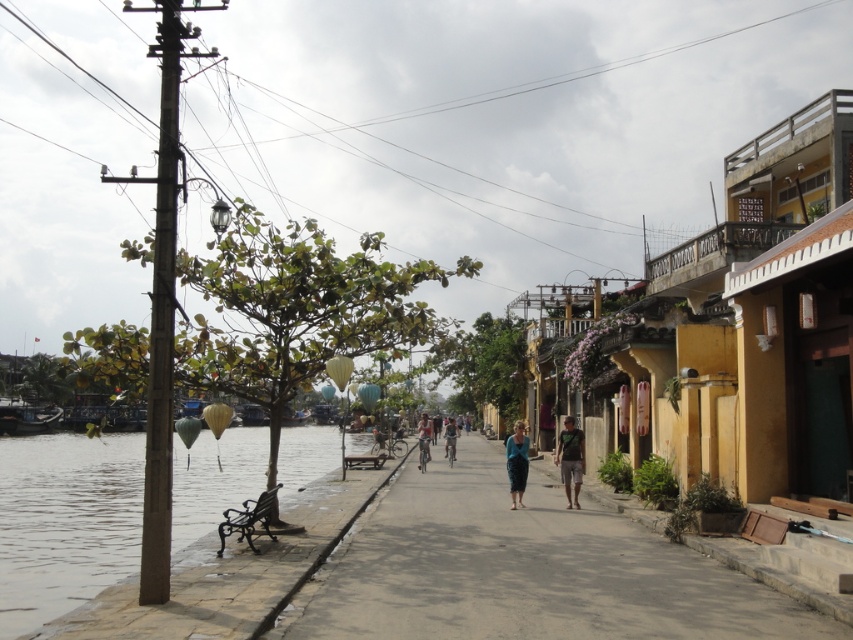
Question: Which object is positioned farthest from the light blue fabric shirt at center?

Choices:
 (A) smooth concrete pavement at center
 (B) blue fabric skirt at center
 (C) green fabric shirt at center

Answer: (A)

Question: Does smooth concrete pavement at center have a lesser width compared to light blue fabric shirt at center?

Choices:
 (A) no
 (B) yes

Answer: (A)

Question: Can you confirm if smooth concrete pavement at center is positioned above light blue fabric at center?

Choices:
 (A) yes
 (B) no

Answer: (A)

Question: Can you confirm if clear water at left is positioned to the left of light blue fabric shirt at center?

Choices:
 (A) yes
 (B) no

Answer: (A)

Question: Which object is the closest to the blue fabric skirt at center?

Choices:
 (A) light blue fabric at center
 (B) smooth concrete pavement at center

Answer: (B)

Question: Estimate the real-world distances between objects in this image. Which object is closer to the light blue fabric shirt at center?

Choices:
 (A) clear water at left
 (B) light blue fabric at center
 (C) smooth concrete pavement at center
 (D) green fabric shirt at center

Answer: (B)